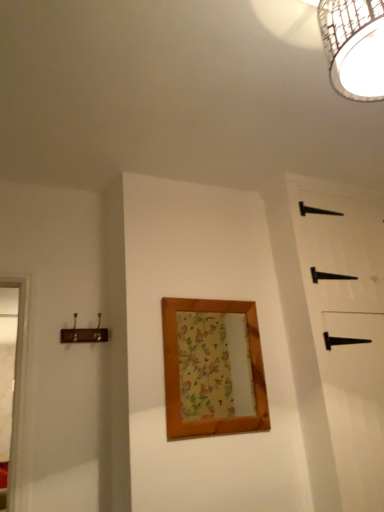
Question: From a real-world perspective, is woven bamboo light fixture at upper right physically above wooden framed mirror at center?

Choices:
 (A) yes
 (B) no

Answer: (A)

Question: Does woven bamboo light fixture at upper right have a smaller size compared to wooden framed mirror at center?

Choices:
 (A) yes
 (B) no

Answer: (B)

Question: Can you confirm if woven bamboo light fixture at upper right is wider than wooden framed mirror at center?

Choices:
 (A) yes
 (B) no

Answer: (A)

Question: Can you confirm if woven bamboo light fixture at upper right is bigger than wooden framed mirror at center?

Choices:
 (A) yes
 (B) no

Answer: (A)

Question: Is woven bamboo light fixture at upper right at the right side of wooden framed mirror at center?

Choices:
 (A) no
 (B) yes

Answer: (B)

Question: Is woven bamboo light fixture at upper right oriented away from wooden framed mirror at center?

Choices:
 (A) yes
 (B) no

Answer: (B)

Question: Is the depth of black matte barn door at right greater than that of woven bamboo light fixture at upper right?

Choices:
 (A) no
 (B) yes

Answer: (B)

Question: From the image's perspective, is black matte barn door at right beneath woven bamboo light fixture at upper right?

Choices:
 (A) no
 (B) yes

Answer: (B)

Question: Does black matte barn door at right appear on the right side of woven bamboo light fixture at upper right?

Choices:
 (A) yes
 (B) no

Answer: (A)

Question: Is black matte barn door at right wider than woven bamboo light fixture at upper right?

Choices:
 (A) no
 (B) yes

Answer: (A)

Question: Would you say black matte barn door at right is a long distance from woven bamboo light fixture at upper right?

Choices:
 (A) no
 (B) yes

Answer: (B)

Question: Considering the relative positions of black matte barn door at right and woven bamboo light fixture at upper right in the image provided, is black matte barn door at right in front of woven bamboo light fixture at upper right?

Choices:
 (A) yes
 (B) no

Answer: (B)

Question: Is black matte barn door at right completely or partially inside wooden framed mirror at center?

Choices:
 (A) yes
 (B) no

Answer: (B)